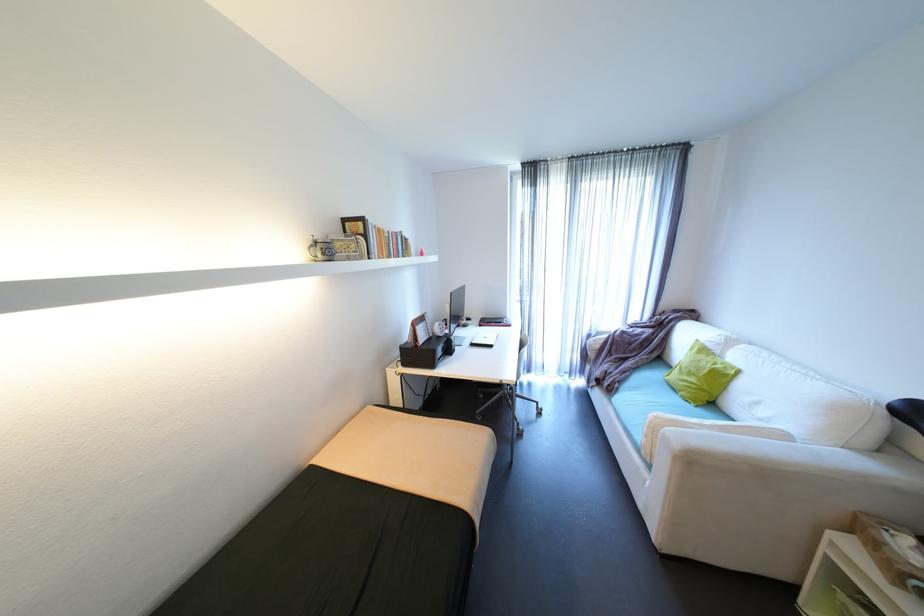
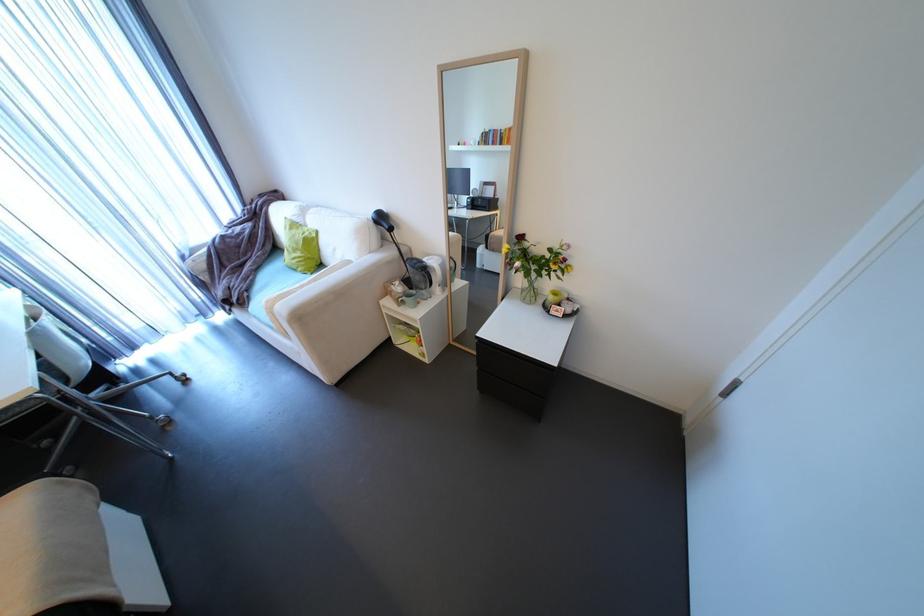
Locate, in the second image, the point that corresponds to (x=706, y=381) in the first image.

(310, 253)